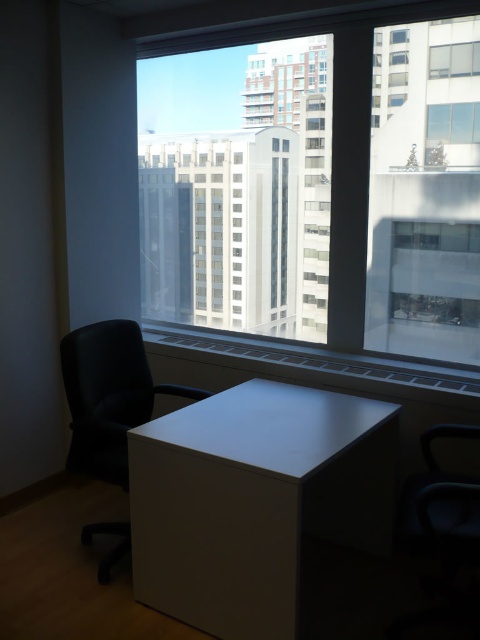
Question: Which object is positioned farthest from the transparent glass window at upper right?

Choices:
 (A) black leather swivel chair at left
 (B) white matte cabinet at center

Answer: (A)

Question: Which point is farther to the camera?

Choices:
 (A) (453, 112)
 (B) (360, 474)
 (C) (81, 380)

Answer: (B)

Question: Is transparent glass window at center positioned behind black leather swivel chair at left?

Choices:
 (A) no
 (B) yes

Answer: (B)

Question: Which object is closer to the camera taking this photo?

Choices:
 (A) transparent glass window at upper center
 (B) transparent glass window at upper right
 (C) transparent glass window at center
 (D) black leather swivel chair at left

Answer: (D)

Question: Is transparent glass window at center to the left of transparent glass window at upper center from the viewer's perspective?

Choices:
 (A) yes
 (B) no

Answer: (A)

Question: Is transparent glass window at center further to camera compared to transparent glass window at upper right?

Choices:
 (A) no
 (B) yes

Answer: (A)